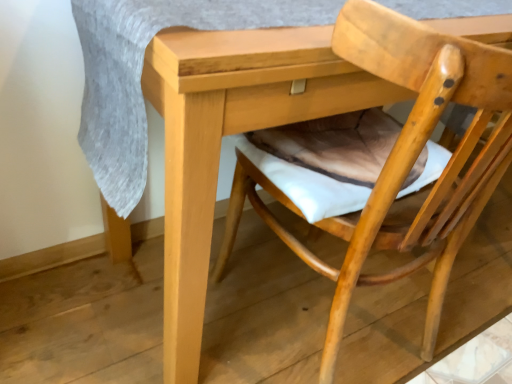
Question: Should I look upward or downward to see natural wood chair at center?

Choices:
 (A) up
 (B) down

Answer: (B)